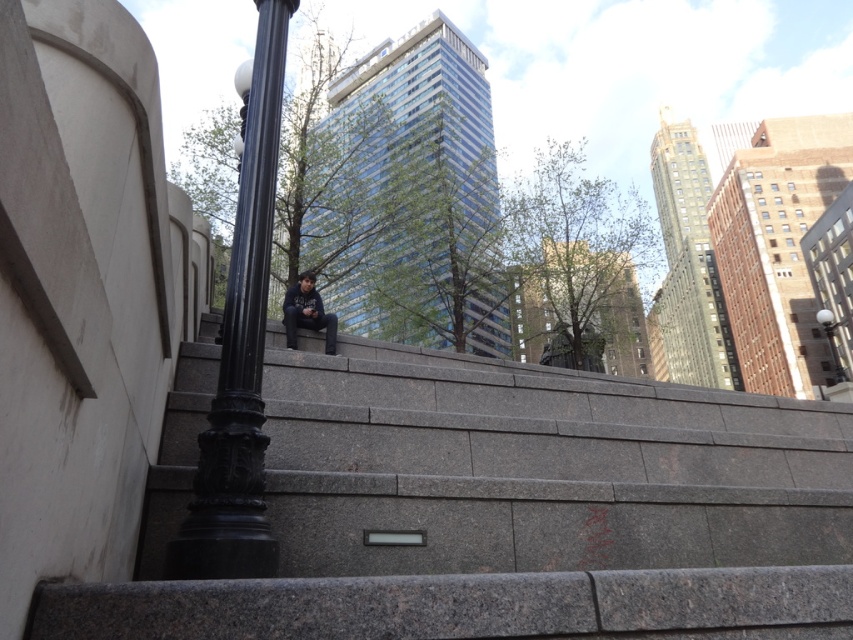
Based on the photo, does gray concrete stairs at center have a lesser width compared to black metal lamp post at upper right?

Indeed, gray concrete stairs at center has a lesser width compared to black metal lamp post at upper right.

Which is behind, point (579, 516) or point (828, 326)?

The point (828, 326) is behind.

Does point (515, 492) come closer to viewer compared to point (822, 323)?

Yes, it is.

Where is `gray concrete stairs at center`? The width and height of the screenshot is (853, 640). gray concrete stairs at center is located at coordinates (538, 467).

Who is more forward, (x=231, y=236) or (x=837, y=324)?

Point (x=231, y=236) is in front.

Who is more forward, [283,61] or [837,369]?

Point [283,61] is more forward.

In order to click on black polished metal pole at left in this screenshot , I will do `click(241, 348)`.

Who is taller, gray concrete stairs at center or dark blue hoodie at center?

With more height is dark blue hoodie at center.

Which is behind, point (767, 513) or point (310, 321)?

Point (310, 321)

You are a GUI agent. You are given a task and a screenshot of the screen. Output one action in this format:
    pyautogui.click(x=<x>, y=<y>)
    Task: Click on the gray concrete stairs at center
    The width and height of the screenshot is (853, 640).
    Given the screenshot: What is the action you would take?
    pyautogui.click(x=538, y=467)